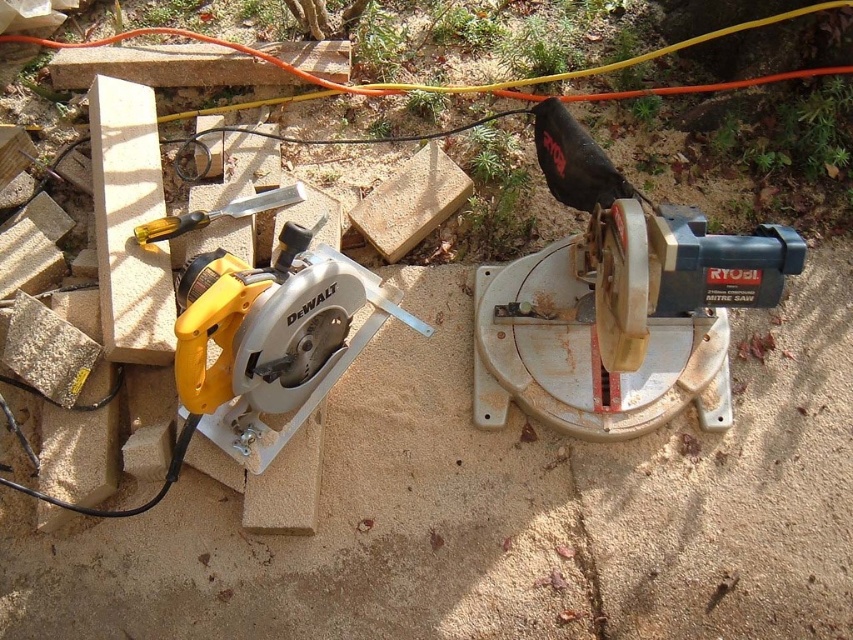
You are a contractor who needs to move both the rusty metal mitre saw at center and the yellow plastic circular saw at left to a storage shed. Which saw should you move first if you want to start with the one closer to the shed located to the right of the scene?

The rusty metal mitre saw at center is to the right of the yellow plastic circular saw at left, so it is closer to the shed on the right. Therefore, you should move the rusty metal mitre saw at center first.